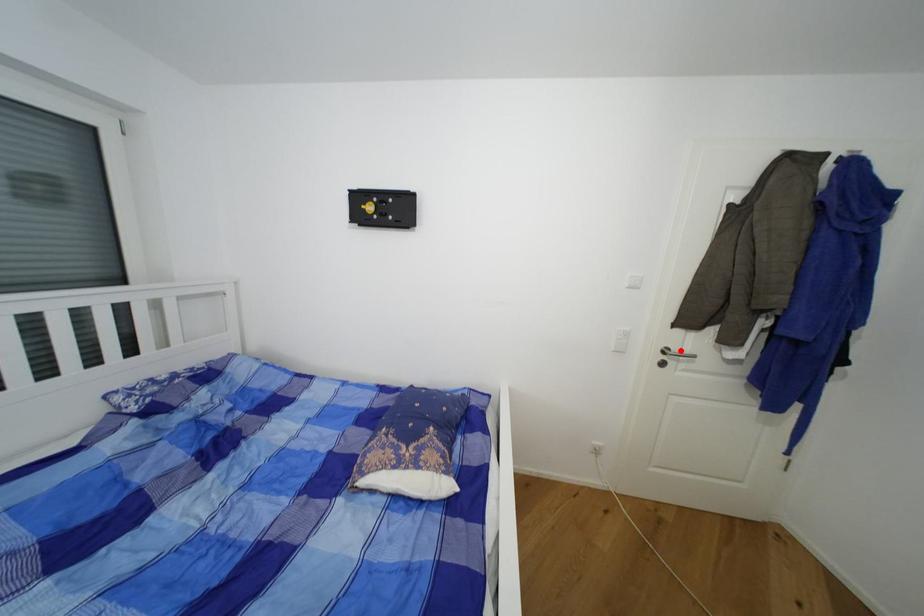
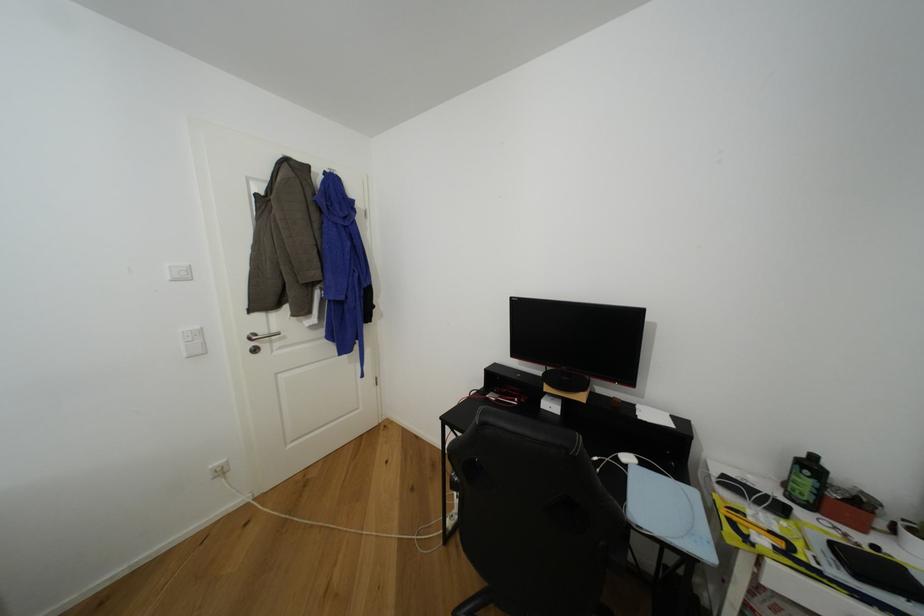
Where in the second image is the point corresponding to the highlighted location from the first image?

(268, 334)